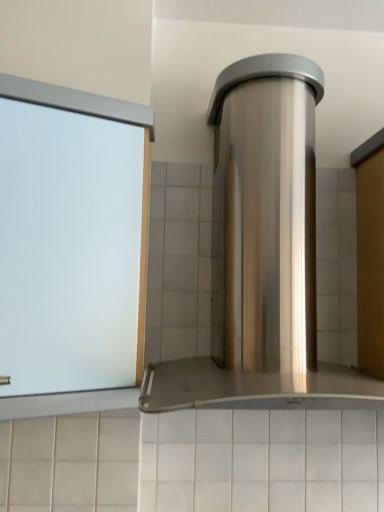
What do you see at coordinates (71, 239) in the screenshot?
I see `frosted glass window at left` at bounding box center [71, 239].

Where is `frosted glass window at left`? The image size is (384, 512). frosted glass window at left is located at coordinates (71, 239).

What do you see at coordinates (262, 255) in the screenshot? The image size is (384, 512). I see `stainless steel range hood at center` at bounding box center [262, 255].

This screenshot has height=512, width=384. What are the coordinates of `stainless steel range hood at center` in the screenshot? It's located at (262, 255).

Locate an element on the screen. This screenshot has width=384, height=512. frosted glass window at left is located at coordinates (71, 239).

Is stainless steel range hood at center at the right side of frosted glass window at left?

Correct, you'll find stainless steel range hood at center to the right of frosted glass window at left.

Considering the relative positions of stainless steel range hood at center and frosted glass window at left in the image provided, is stainless steel range hood at center behind frosted glass window at left?

That is False.

Is point (288, 286) closer or farther from the camera than point (62, 338)?

Point (288, 286) appears to be farther away from the viewer than point (62, 338).

From the image's perspective, between stainless steel range hood at center and frosted glass window at left, who is located below?

frosted glass window at left, from the image's perspective.

From a real-world perspective, is stainless steel range hood at center on top of frosted glass window at left?

Yes, from a real-world perspective, stainless steel range hood at center is above frosted glass window at left.

Considering the sizes of objects stainless steel range hood at center and frosted glass window at left in the image provided, who is wider, stainless steel range hood at center or frosted glass window at left?

stainless steel range hood at center.

Based on the photo, considering the sizes of objects stainless steel range hood at center and frosted glass window at left in the image provided, who is taller, stainless steel range hood at center or frosted glass window at left?

stainless steel range hood at center.

Does stainless steel range hood at center have a smaller size compared to frosted glass window at left?

Actually, stainless steel range hood at center might be larger than frosted glass window at left.

Is frosted glass window at left located within stainless steel range hood at center?

No, frosted glass window at left is not inside stainless steel range hood at center.

Is stainless steel range hood at center not close to frosted glass window at left?

Actually, stainless steel range hood at center and frosted glass window at left are a little close together.

Is stainless steel range hood at center oriented towards frosted glass window at left?

No.

Can you tell me how much stainless steel range hood at center and frosted glass window at left differ in facing direction?

0.646 degrees separate the facing orientations of stainless steel range hood at center and frosted glass window at left.

This screenshot has width=384, height=512. I want to click on home appliance located above the frosted glass window at left (from a real-world perspective), so click(x=262, y=255).

Does frosted glass window at left appear on the right side of stainless steel range hood at center?

Incorrect, frosted glass window at left is not on the right side of stainless steel range hood at center.

Does frosted glass window at left come in front of stainless steel range hood at center?

No, the depth of frosted glass window at left is greater than that of stainless steel range hood at center.

Which is further, (116, 371) or (191, 385)?

Positioned behind is point (116, 371).

From the image's perspective, would you say frosted glass window at left is shown under stainless steel range hood at center?

Yes, from the image's perspective, frosted glass window at left is below stainless steel range hood at center.

From a real-world perspective, relative to stainless steel range hood at center, is frosted glass window at left vertically above or below?

In terms of real-world spatial position, frosted glass window at left is below stainless steel range hood at center.

Considering the relative sizes of frosted glass window at left and stainless steel range hood at center in the image provided, is frosted glass window at left thinner than stainless steel range hood at center?

Yes, frosted glass window at left is thinner than stainless steel range hood at center.

Considering the relative sizes of frosted glass window at left and stainless steel range hood at center in the image provided, is frosted glass window at left shorter than stainless steel range hood at center?

Yes.

Who is bigger, frosted glass window at left or stainless steel range hood at center?

stainless steel range hood at center is bigger.

Is frosted glass window at left inside the boundaries of stainless steel range hood at center, or outside?

frosted glass window at left is not inside stainless steel range hood at center, it's outside.

Looking at this image, is frosted glass window at left not close to stainless steel range hood at center?

No, frosted glass window at left is not far away from stainless steel range hood at center.

Does frosted glass window at left turn towards stainless steel range hood at center?

No.

Can you tell me how much frosted glass window at left and stainless steel range hood at center differ in facing direction?

The angle between the facing direction of frosted glass window at left and the facing direction of stainless steel range hood at center is 0.646 degrees.

Measure the distance from frosted glass window at left to stainless steel range hood at center.

A distance of 32.56 centimeters exists between frosted glass window at left and stainless steel range hood at center.

This screenshot has width=384, height=512. I want to click on home appliance on the right of frosted glass window at left, so click(262, 255).

Identify the location of window located behind the stainless steel range hood at center. The width and height of the screenshot is (384, 512). [x=71, y=239].

Where is `window below the stainless steel range hood at center (from a real-world perspective)`? window below the stainless steel range hood at center (from a real-world perspective) is located at coordinates (71, 239).